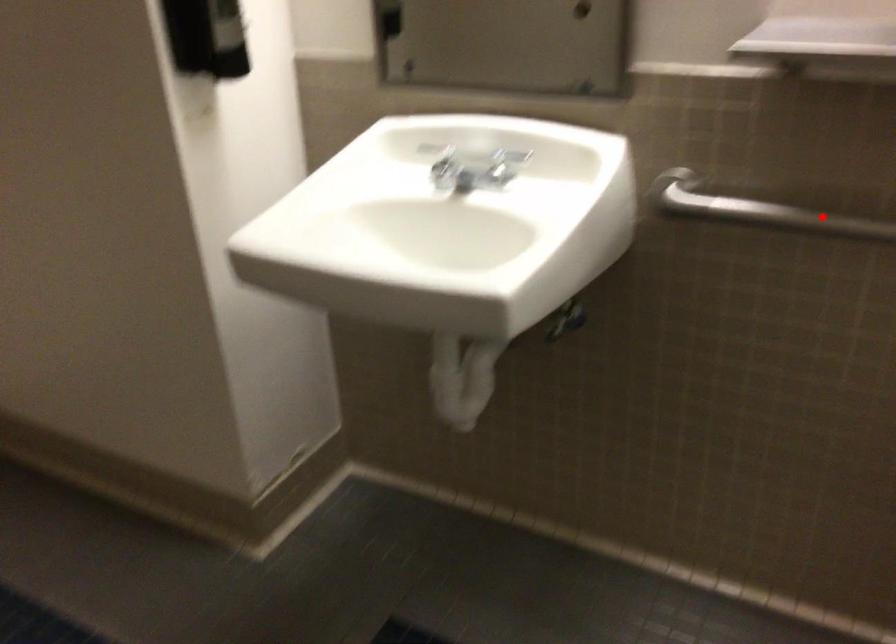
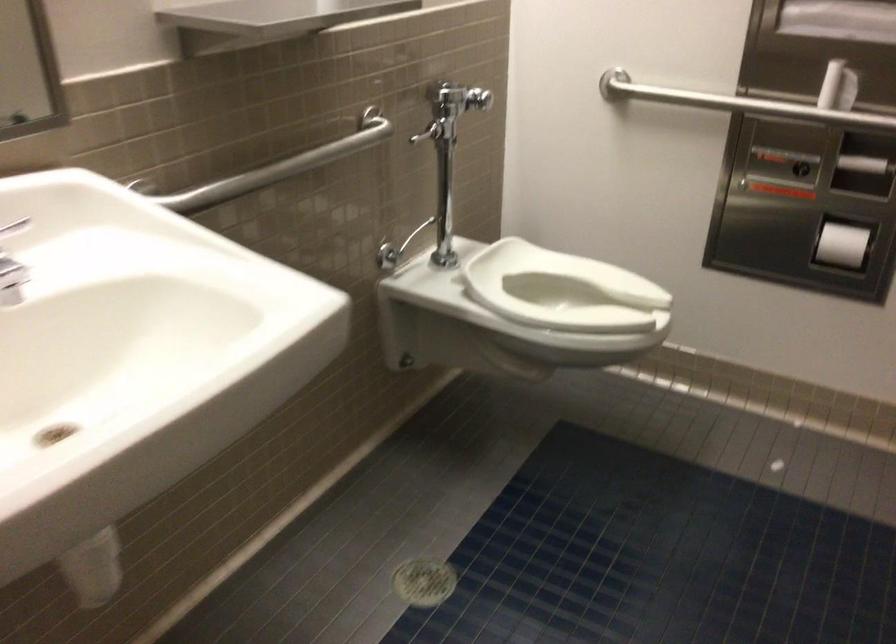
Question: I am providing you with two images of the same scene from different viewpoints. A red point is shown in image1. For the corresponding object point in image2, is it positioned nearer or farther from the camera?

Choices:
 (A) Nearer
 (B) Farther

Answer: (B)